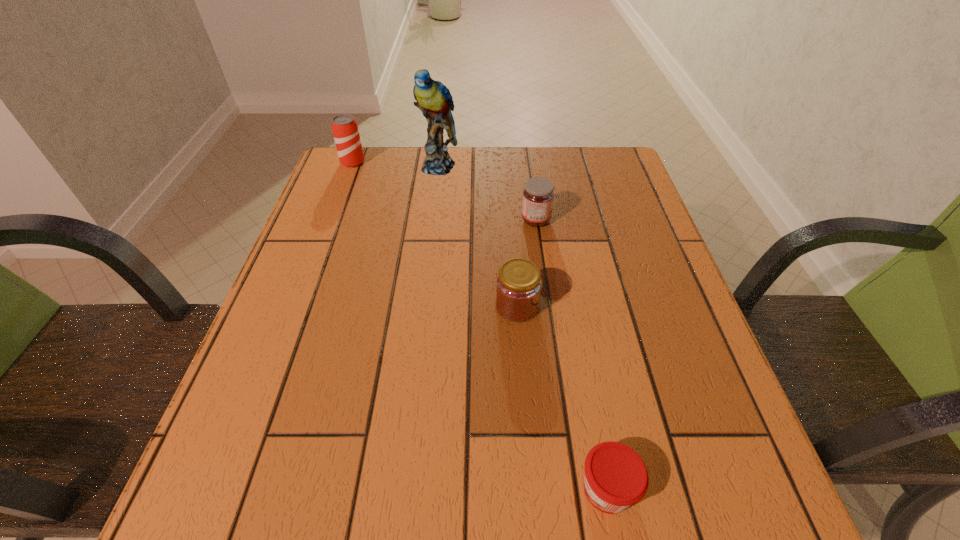
You are a GUI agent. You are given a task and a screenshot of the screen. Output one action in this format:
    pyautogui.click(x=<x>, y=<y>)
    Task: Click on the vacant space that satisfies the following two spatial constraints: 1. on the front side of the fourth shortest object; 2. on the right side of the third farthest object
    This screenshot has height=540, width=960.
    Given the screenshot: What is the action you would take?
    pyautogui.click(x=331, y=220)